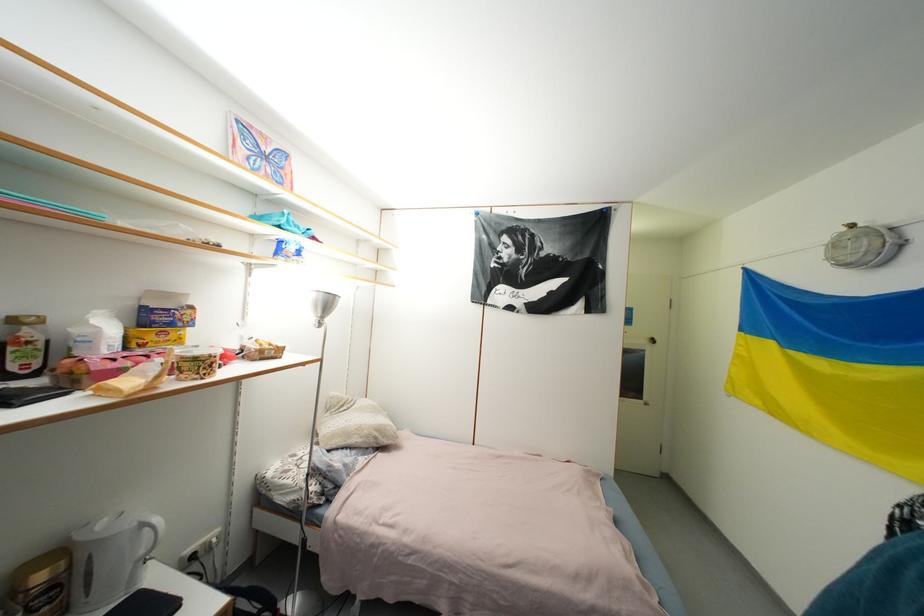
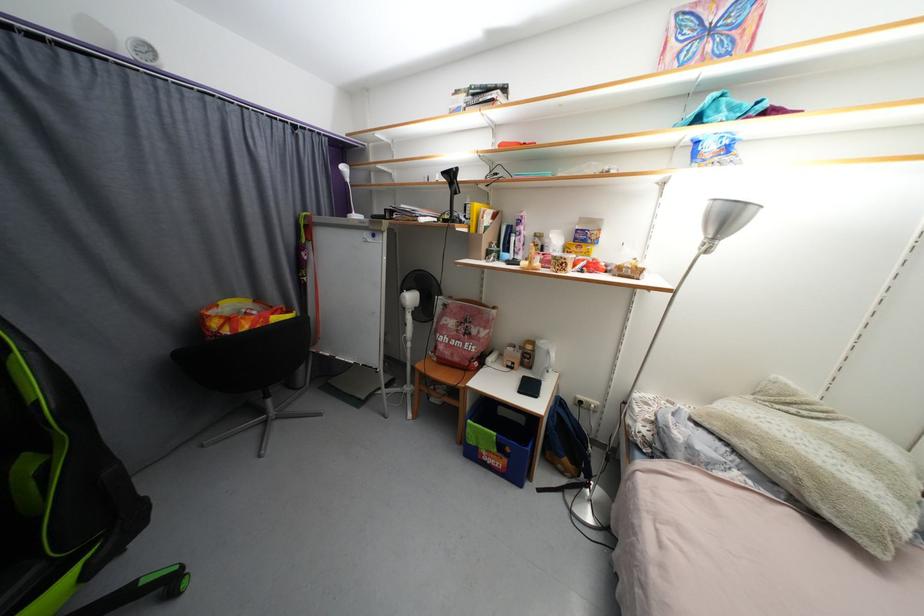
Find the pixel in the second image that matches (x=65, y=554) in the first image.

(538, 344)